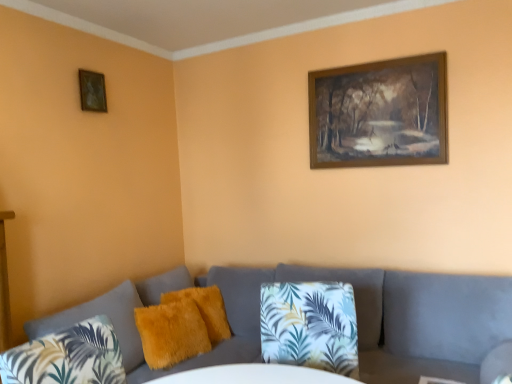
Question: Could you tell me if fuzzy yellow pillow at center, which appears as the 2th pillow when viewed from the front, is facing fuzzy yellow pillow at center, arranged as the third pillow when viewed from the front?

Choices:
 (A) yes
 (B) no

Answer: (B)

Question: Is fuzzy yellow pillow at center, which appears as the 2th pillow when viewed from the front, turned away from fuzzy yellow pillow at center, arranged as the third pillow when viewed from the front?

Choices:
 (A) no
 (B) yes

Answer: (A)

Question: Is fuzzy yellow pillow at center, arranged as the third pillow when viewed from the front, located within fuzzy yellow pillow at center, which appears as the 2th pillow when viewed from the front?

Choices:
 (A) yes
 (B) no

Answer: (B)

Question: From a real-world perspective, is fuzzy yellow pillow at center, which ranks as the 2th pillow in back-to-front order, on fuzzy yellow pillow at center, arranged as the third pillow when viewed from the front?

Choices:
 (A) yes
 (B) no

Answer: (B)

Question: Is fuzzy yellow pillow at center, which ranks as the 2th pillow in back-to-front order, thinner than fuzzy yellow pillow at center, positioned as the 1th pillow in back-to-front order?

Choices:
 (A) no
 (B) yes

Answer: (B)

Question: Is there a large distance between fuzzy yellow pillow at center, which appears as the 2th pillow when viewed from the front, and fuzzy yellow pillow at center, arranged as the third pillow when viewed from the front?

Choices:
 (A) yes
 (B) no

Answer: (B)

Question: Could velvet grey couch at lower center be considered to be inside fuzzy yellow pillow at center, arranged as the third pillow when viewed from the front?

Choices:
 (A) no
 (B) yes

Answer: (A)

Question: Is fuzzy yellow pillow at center, arranged as the third pillow when viewed from the front, not near velvet grey couch at lower center?

Choices:
 (A) no
 (B) yes

Answer: (A)

Question: Is fuzzy yellow pillow at center, arranged as the third pillow when viewed from the front, in contact with velvet grey couch at lower center?

Choices:
 (A) yes
 (B) no

Answer: (B)

Question: Can you confirm if fuzzy yellow pillow at center, positioned as the 1th pillow in back-to-front order, is bigger than velvet grey couch at lower center?

Choices:
 (A) no
 (B) yes

Answer: (A)

Question: From the image's perspective, is fuzzy yellow pillow at center, arranged as the third pillow when viewed from the front, below velvet grey couch at lower center?

Choices:
 (A) yes
 (B) no

Answer: (B)

Question: Does fuzzy yellow pillow at center, arranged as the third pillow when viewed from the front, have a smaller size compared to velvet grey couch at lower center?

Choices:
 (A) no
 (B) yes

Answer: (B)

Question: Considering the relative positions of wooden frame at upper right, acting as the 2th picture frame starting from the left, and velvet grey couch at lower center in the image provided, is wooden frame at upper right, acting as the 2th picture frame starting from the left, to the right of velvet grey couch at lower center from the viewer's perspective?

Choices:
 (A) yes
 (B) no

Answer: (A)